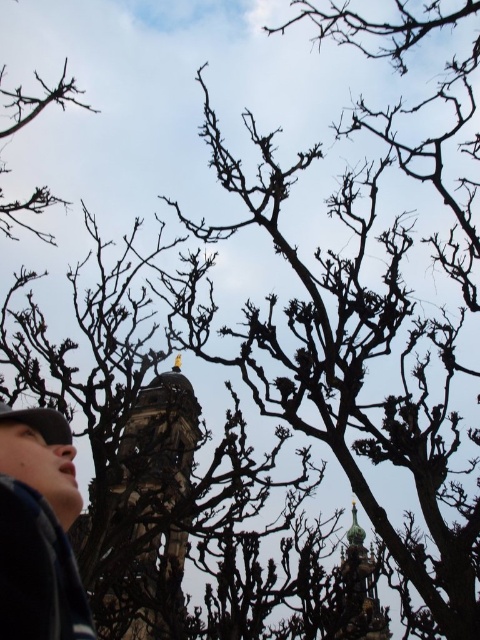
You are standing in a forest and see both the stone tower at center and the green glazed tower at center. Which tower is positioned to the left?

The stone tower at center is positioned to the left of the green glazed tower at center.